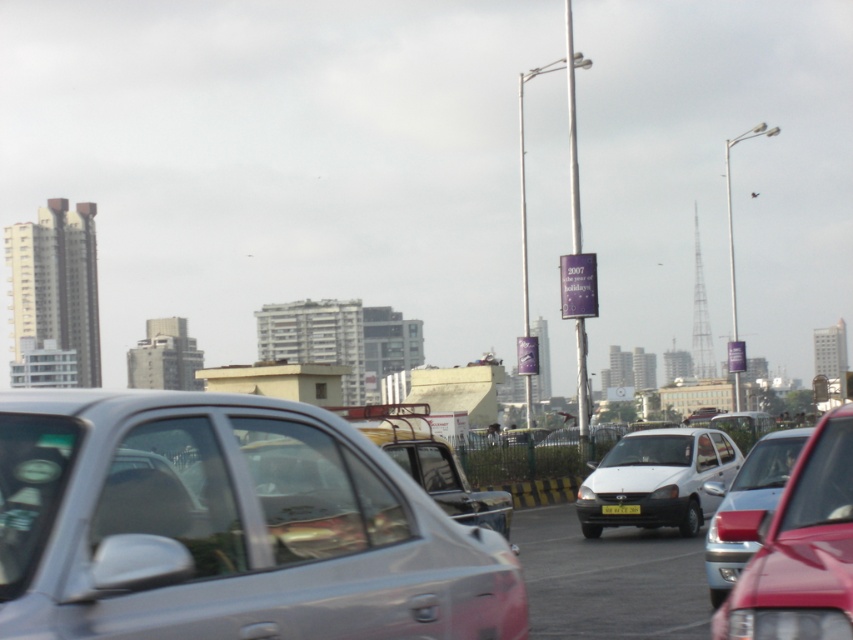
Is point (712, 621) closer to viewer compared to point (688, 493)?

Yes, point (712, 621) is in front of point (688, 493).

Where is `metallic silver sedan at center`? This screenshot has height=640, width=853. metallic silver sedan at center is located at coordinates (798, 547).

This screenshot has width=853, height=640. I want to click on metallic silver sedan at center, so click(798, 547).

The height and width of the screenshot is (640, 853). In order to click on metallic silver sedan at center in this screenshot , I will do `click(798, 547)`.

Between point (36, 572) and point (651, 520), which one is positioned in front?

Point (36, 572) is in front.

Who is taller, silver metallic car at center or white matte sedan at center?

Standing taller between the two is white matte sedan at center.

Identify the location of silver metallic car at center. This screenshot has height=640, width=853. (228, 525).

You are a GUI agent. You are given a task and a screenshot of the screen. Output one action in this format:
    pyautogui.click(x=<x>, y=<y>)
    Task: Click on the silver metallic car at center
    The image size is (853, 640).
    Given the screenshot: What is the action you would take?
    pyautogui.click(x=228, y=525)

Which of these two, metallic silver sedan at center or yellow matte license plate at center, stands taller?

Standing taller between the two is metallic silver sedan at center.

Does point (798, 474) come in front of point (602, 506)?

Yes, it is.

At what (x,y) coordinates should I click in order to perform the action: click on metallic silver sedan at center. Please return your answer as a coordinate pair (x, y). Looking at the image, I should click on (798, 547).

Identify the location of metallic silver sedan at center. The width and height of the screenshot is (853, 640). (798, 547).